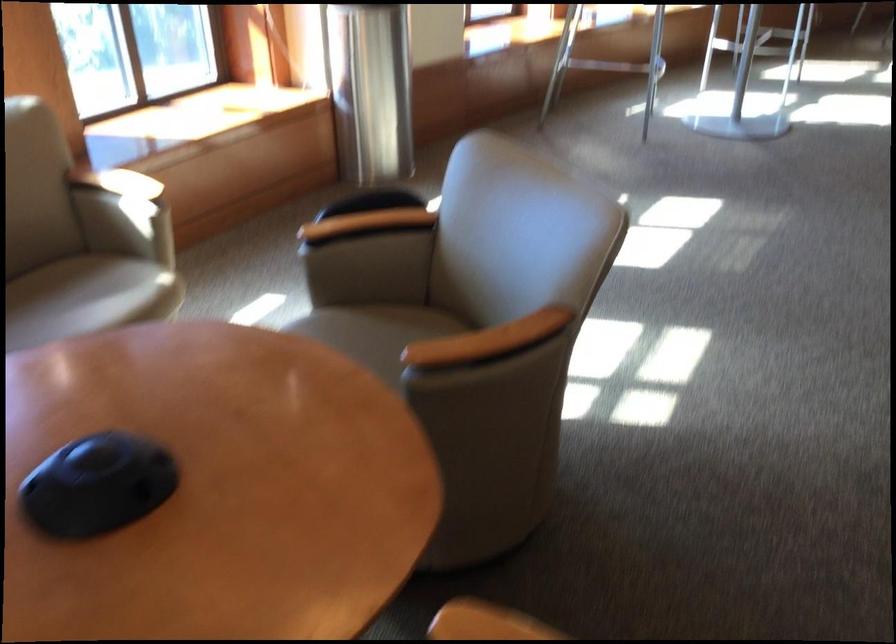
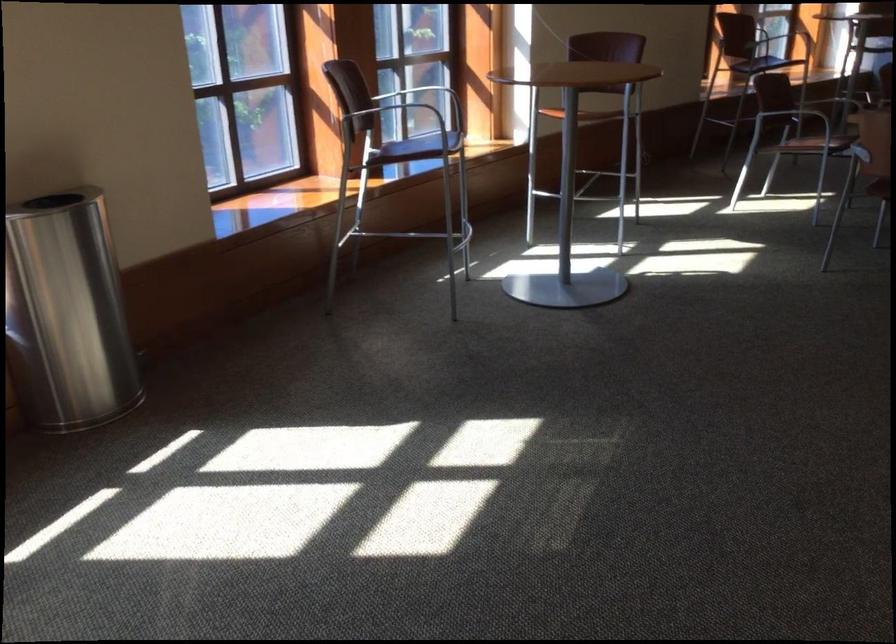
Which direction would the cameraman need to move to produce the second image?

The movement direction of the cameraman is right, forward.